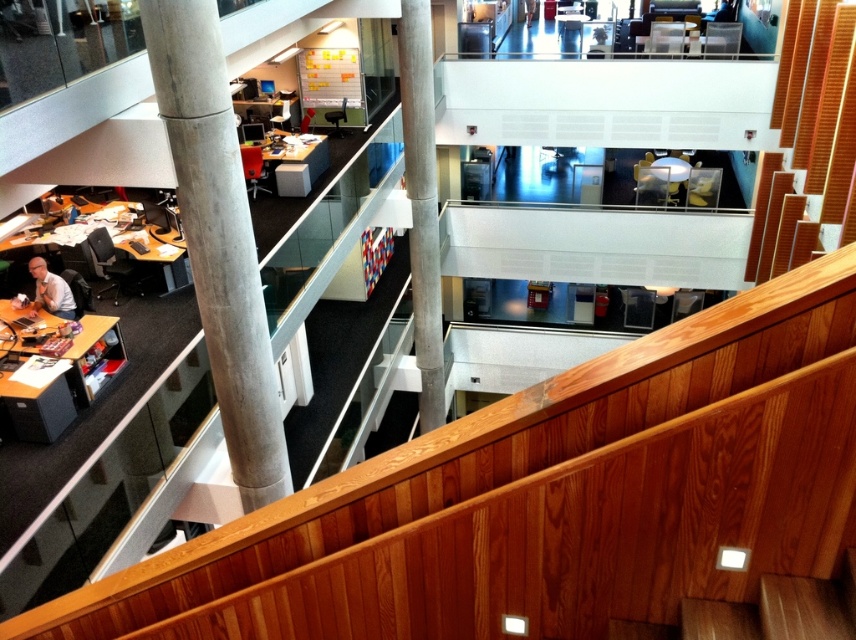
Who is lower down, concrete at left or concrete pillar at center?

concrete at left

Is concrete at left thinner than concrete pillar at center?

In fact, concrete at left might be wider than concrete pillar at center.

Between point (162, 20) and point (438, 342), which one is positioned behind?

Positioned behind is point (438, 342).

Identify the location of concrete at left. (218, 237).

Is point (836, 116) closer to viewer compared to point (60, 288)?

Yes, point (836, 116) is in front of point (60, 288).

Can you confirm if wooden stairs at upper center is smaller than matte gray shirt at lower left?

Actually, wooden stairs at upper center might be larger than matte gray shirt at lower left.

Locate an element on the screen. This screenshot has width=856, height=640. wooden stairs at upper center is located at coordinates (825, 115).

You are a GUI agent. You are given a task and a screenshot of the screen. Output one action in this format:
    pyautogui.click(x=<x>, y=<y>)
    Task: Click on the wooden stairs at upper center
    The width and height of the screenshot is (856, 640).
    Given the screenshot: What is the action you would take?
    pyautogui.click(x=825, y=115)

Which is in front, point (418, 131) or point (39, 301)?

Point (39, 301) is in front.

From the picture: Between concrete pillar at center and matte gray shirt at lower left, which one is positioned lower?

matte gray shirt at lower left

Is point (431, 237) positioned behind point (51, 304)?

Yes, it is.

Locate an element on the screen. The height and width of the screenshot is (640, 856). concrete pillar at center is located at coordinates (421, 204).